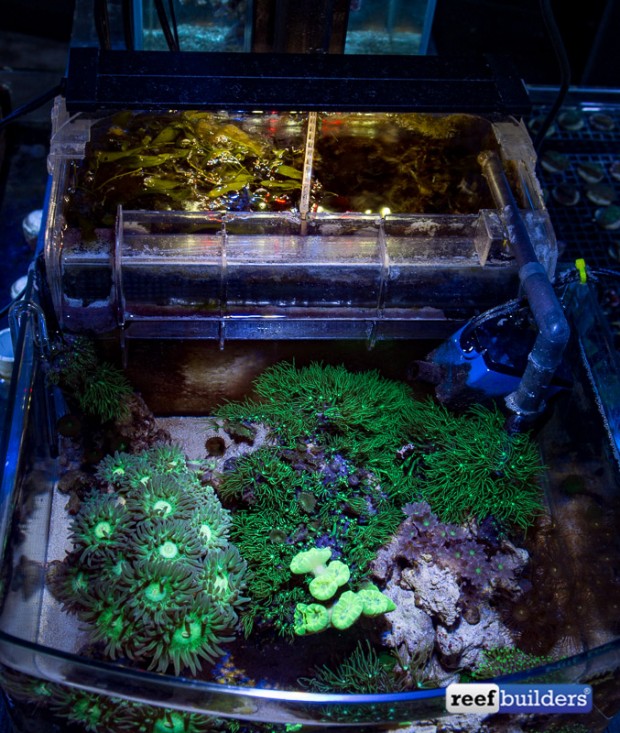
Where is `divider`? This screenshot has height=733, width=620. divider is located at coordinates (304, 166).